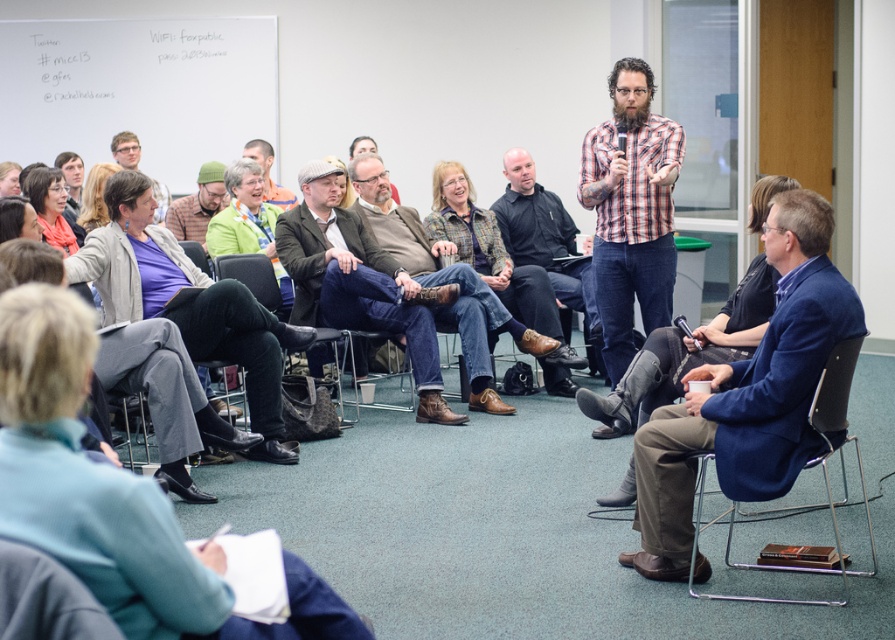
Question: Which point is closer to the camera?

Choices:
 (A) green knitted hat at center
 (B) matte purple shirt at lower left

Answer: (A)

Question: Is green knit cap at center further to camera compared to green sweater at center?

Choices:
 (A) no
 (B) yes

Answer: (A)

Question: From the image, what is the correct spatial relationship of black leather jacket at center in relation to matte purple sweater at lower left?

Choices:
 (A) left
 (B) right

Answer: (B)

Question: Estimate the real-world distances between objects in this image. Which object is farther from the green knitted hat at center?

Choices:
 (A) green sweater at center
 (B) blue woolen jacket at lower right
 (C) leather boots at center

Answer: (B)

Question: Does black fabric chair at center appear on the left side of green knit cap at center?

Choices:
 (A) no
 (B) yes

Answer: (A)

Question: Which object is positioned closest to the matte purple sweater at center?

Choices:
 (A) denim jeans at center
 (B) green knitted hat at center
 (C) matte purple sweater at lower left

Answer: (C)